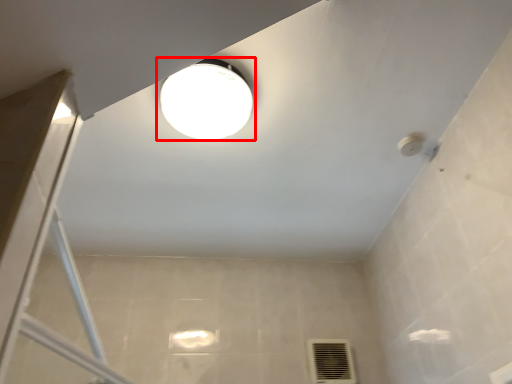
Question: In this image, where is lamp (annotated by the red box) located relative to air conditioning?

Choices:
 (A) right
 (B) left

Answer: (B)